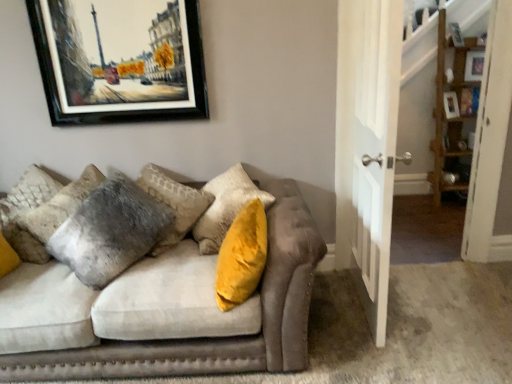
Identify the location of free space to the left of white wooden door at center. The width and height of the screenshot is (512, 384). point(327,310).